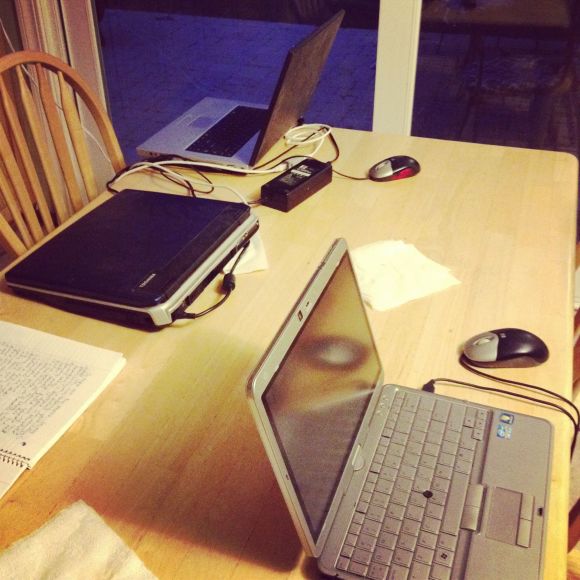
Identify the location of keyboard. Image resolution: width=580 pixels, height=580 pixels. (230, 137), (407, 478).